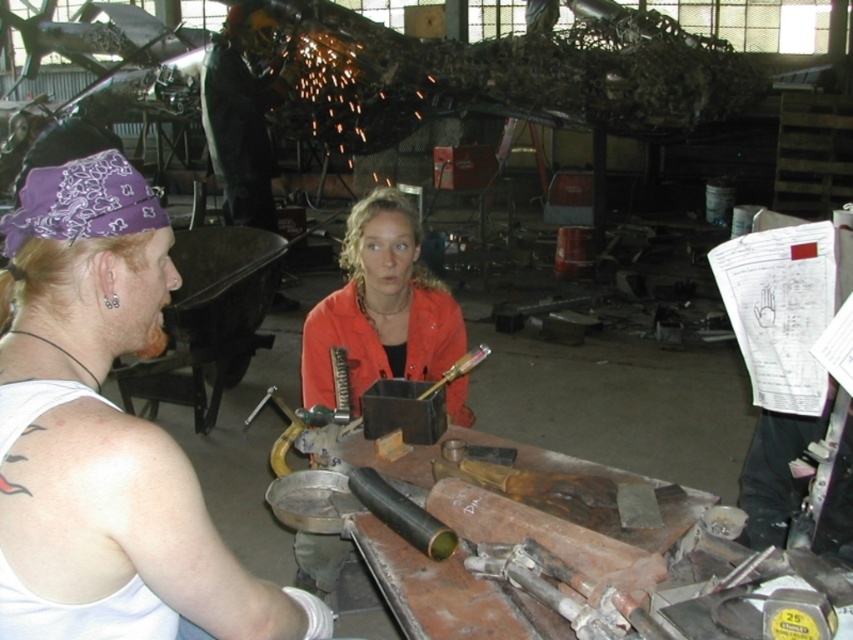
In the workshop scene, you need to locate the orange matte jacket at center. What are its exact coordinates?

The orange matte jacket at center is located at coordinates point [380,307].

You are an inspector in the workshop and need to locate the orange matte jacket at center and the shiny black helmet at upper center. From your vantage point, which object is positioned higher?

The shiny black helmet at upper center is positioned higher than the orange matte jacket at center.